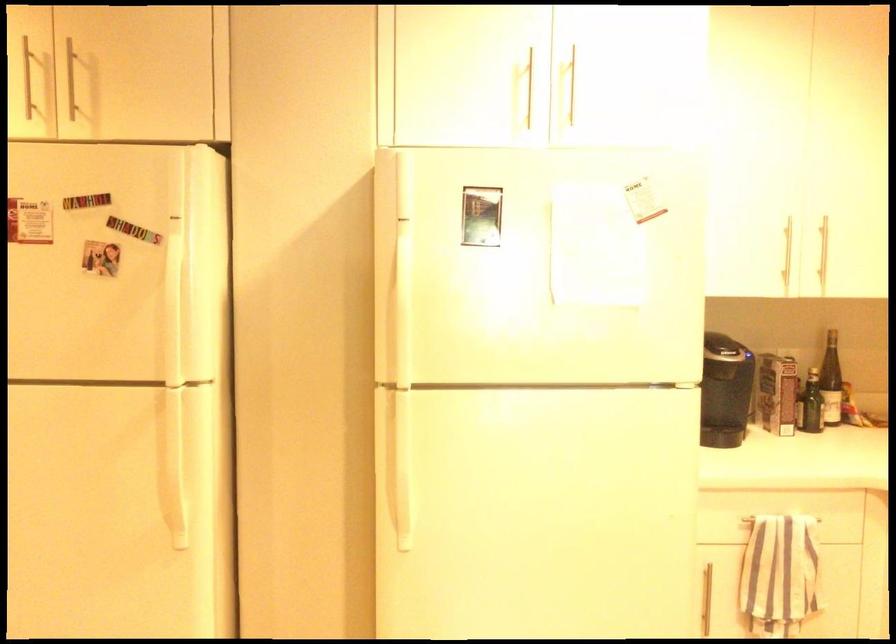
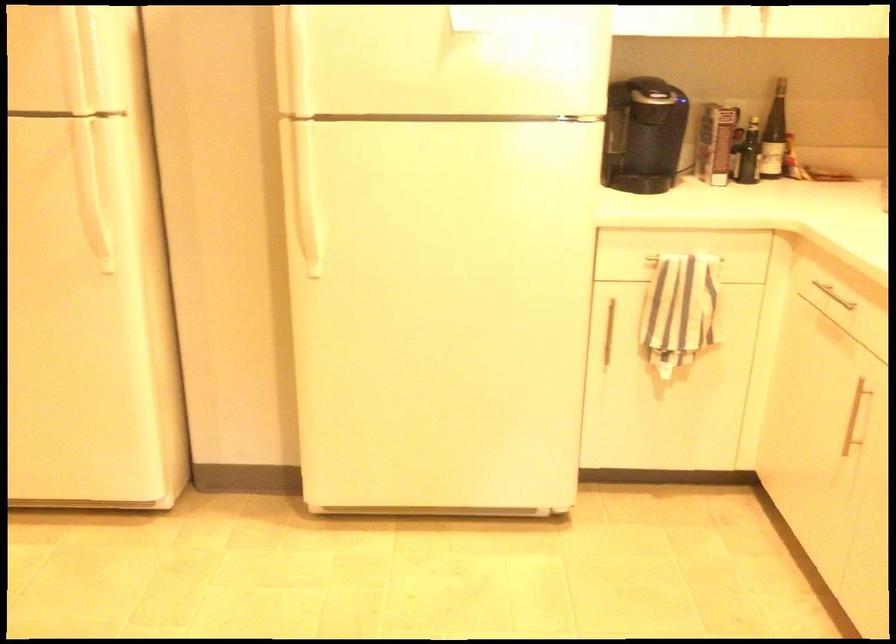
Question: What movement of the cameraman would produce the second image?

Choices:
 (A) Left
 (B) Right
 (C) Forward
 (D) Backward

Answer: (B)